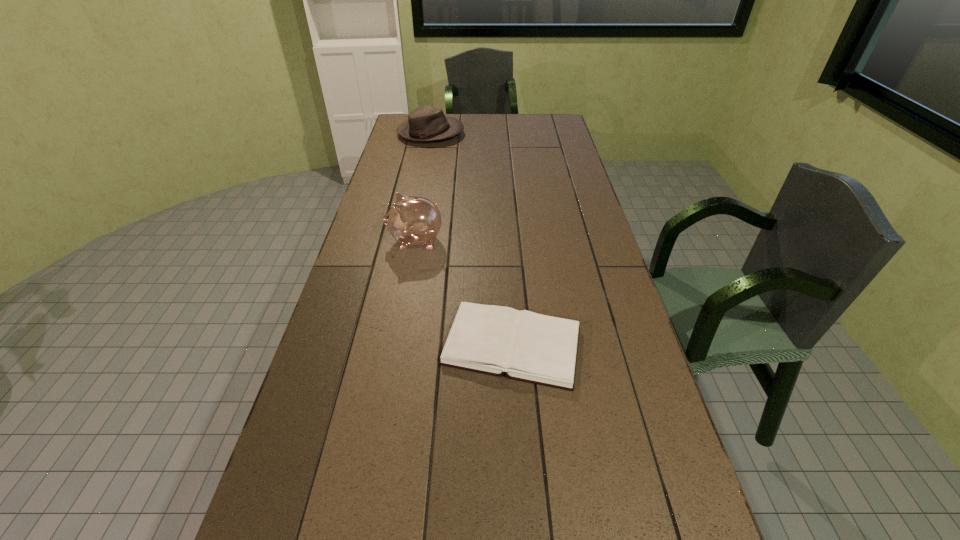
Where is `blank area in the image that satisfies the following two spatial constraints: 1. on the front facing side of the second farthest object; 2. on the left side of the nearest object`? The image size is (960, 540). blank area in the image that satisfies the following two spatial constraints: 1. on the front facing side of the second farthest object; 2. on the left side of the nearest object is located at coordinates (396, 346).

Locate an element on the screen. This screenshot has width=960, height=540. vacant space that satisfies the following two spatial constraints: 1. on the decorative side of the hardback book; 2. on the right side of the farthest object is located at coordinates (390, 346).

The width and height of the screenshot is (960, 540). Find the location of `vacant space that satisfies the following two spatial constraints: 1. on the front facing side of the second nearest object; 2. on the back side of the nearest object`. vacant space that satisfies the following two spatial constraints: 1. on the front facing side of the second nearest object; 2. on the back side of the nearest object is located at coordinates (396, 346).

The width and height of the screenshot is (960, 540). What are the coordinates of `free location that satisfies the following two spatial constraints: 1. on the front facing side of the tallest object; 2. on the right side of the shortest object` in the screenshot? It's located at (396, 346).

Image resolution: width=960 pixels, height=540 pixels. I want to click on vacant area that satisfies the following two spatial constraints: 1. on the decorative side of the hat; 2. on the back side of the hardback book, so click(390, 346).

Where is `vacant region that satisfies the following two spatial constraints: 1. on the front facing side of the tallest object; 2. on the right side of the shortest object`? The image size is (960, 540). vacant region that satisfies the following two spatial constraints: 1. on the front facing side of the tallest object; 2. on the right side of the shortest object is located at coordinates (396, 346).

Image resolution: width=960 pixels, height=540 pixels. Find the location of `free spot that satisfies the following two spatial constraints: 1. on the front facing side of the piggy bank; 2. on the left side of the nearest object`. free spot that satisfies the following two spatial constraints: 1. on the front facing side of the piggy bank; 2. on the left side of the nearest object is located at coordinates (396, 346).

The width and height of the screenshot is (960, 540). I want to click on vacant space that satisfies the following two spatial constraints: 1. on the decorative side of the second tallest object; 2. on the back side of the hardback book, so click(x=390, y=346).

Locate an element on the screen. This screenshot has height=540, width=960. vacant space that satisfies the following two spatial constraints: 1. on the decorative side of the shortest object; 2. on the left side of the second tallest object is located at coordinates 390,346.